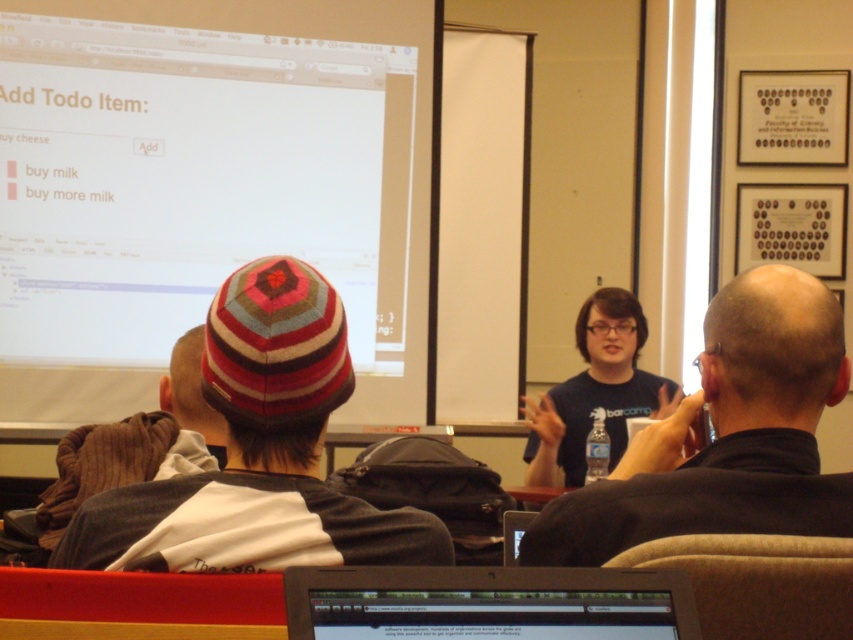
Question: Based on their relative distances, which object is farther from the black shirt at upper center?

Choices:
 (A) knitted wool hat at upper left
 (B) white matte projection screen at upper left

Answer: (B)

Question: In this image, where is black shirt at upper center located relative to dark blue t-shirt at center?

Choices:
 (A) above
 (B) below

Answer: (A)

Question: Does knitted woolen hat at center lie in front of black shirt at upper center?

Choices:
 (A) no
 (B) yes

Answer: (B)

Question: Is black shirt at upper center bigger than dark blue t-shirt at center?

Choices:
 (A) no
 (B) yes

Answer: (A)

Question: Which is nearer to the black shirt at upper center?

Choices:
 (A) dark blue t-shirt at center
 (B) knitted wool hat at upper left
 (C) knitted woolen hat at center
 (D) silver plastic laptop at lower center

Answer: (C)

Question: Which object is positioned closest to the dark blue t-shirt at center?

Choices:
 (A) black shirt at upper center
 (B) white matte projection screen at upper left
 (C) knitted woolen hat at center
 (D) silver plastic laptop at lower center

Answer: (B)